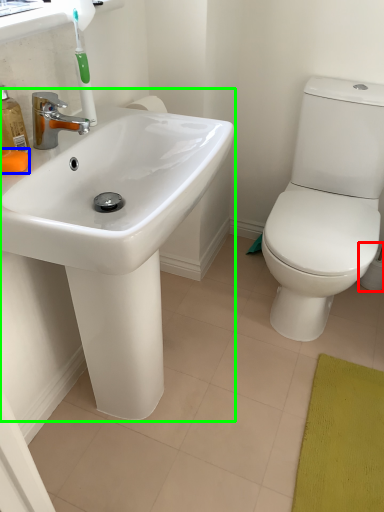
Question: Which object is the farthest from toilet paper (highlighted by a red box)? Choose among these: soap (highlighted by a blue box) or sink (highlighted by a green box).

Choices:
 (A) soap
 (B) sink

Answer: (A)